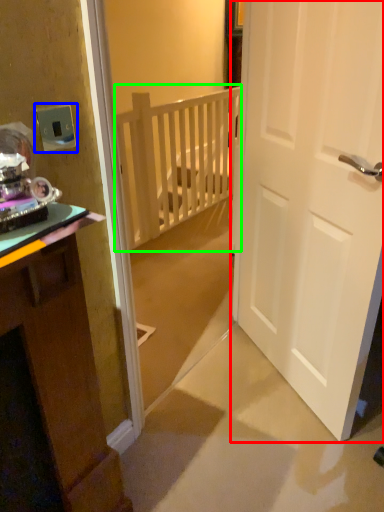
Question: Estimate the real-world distances between objects in this image. Which object is farther from door (highlighted by a red box), electric outlet (highlighted by a blue box) or balustrade (highlighted by a green box)?

Choices:
 (A) electric outlet
 (B) balustrade

Answer: (B)